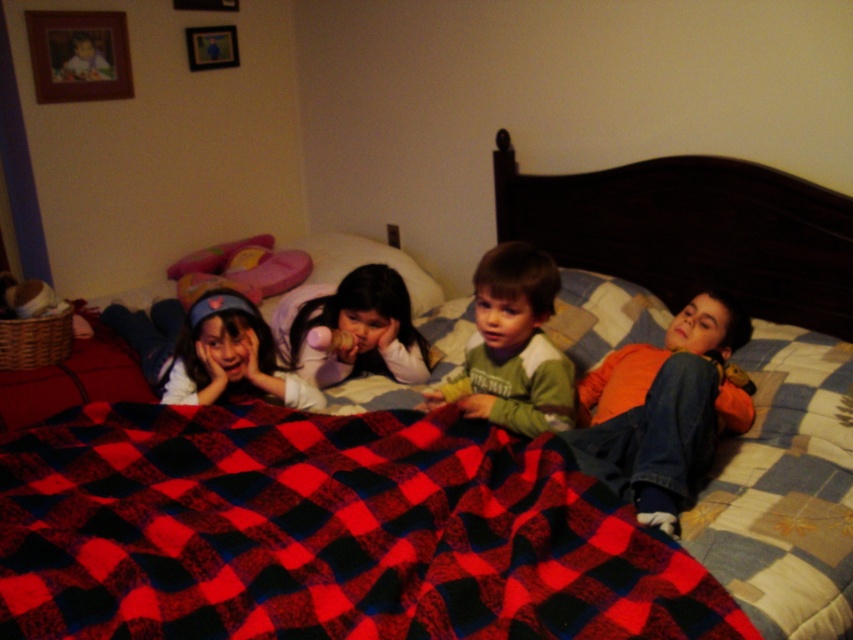
You are a parent trying to cover your children with the red plaid blanket at center. You are standing 1.2 meters away from the blanket. Can you reach the blanket without moving closer?

The red plaid blanket at center and viewer are 1.03 meters apart from each other. Since you are standing 1.2 meters away, you are slightly farther than the distance between the blanket and the viewer. Therefore, you might not be able to reach the blanket without moving closer.